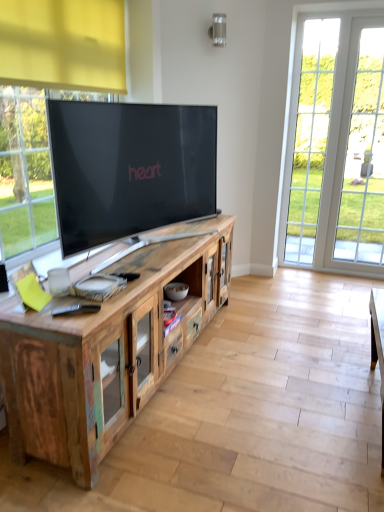
Question: From the image's perspective, is white glass door at right beneath rustic wood cabinet at center?

Choices:
 (A) no
 (B) yes

Answer: (A)

Question: Is the depth of white glass door at right less than that of rustic wood cabinet at center?

Choices:
 (A) no
 (B) yes

Answer: (A)

Question: From the image's perspective, is white glass door at right over rustic wood cabinet at center?

Choices:
 (A) no
 (B) yes

Answer: (B)

Question: Is white glass door at right looking in the opposite direction of rustic wood cabinet at center?

Choices:
 (A) yes
 (B) no

Answer: (B)

Question: Is white glass door at right at the left side of rustic wood cabinet at center?

Choices:
 (A) yes
 (B) no

Answer: (B)

Question: Is rustic wood cabinet at center a part of white glass door at right?

Choices:
 (A) no
 (B) yes

Answer: (A)

Question: Does rustic wood cabinet at center have a greater height compared to white glass door at right?

Choices:
 (A) yes
 (B) no

Answer: (B)

Question: Is rustic wood cabinet at center positioned with its back to white glass door at right?

Choices:
 (A) yes
 (B) no

Answer: (B)

Question: Is rustic wood cabinet at center next to white glass door at right and touching it?

Choices:
 (A) yes
 (B) no

Answer: (B)

Question: Is rustic wood cabinet at center outside of white glass door at right?

Choices:
 (A) no
 (B) yes

Answer: (B)

Question: From a real-world perspective, is rustic wood cabinet at center positioned over white glass door at right based on gravity?

Choices:
 (A) yes
 (B) no

Answer: (B)

Question: Is rustic wood cabinet at center to the left of white glass door at right from the viewer's perspective?

Choices:
 (A) yes
 (B) no

Answer: (A)

Question: From a real-world perspective, relative to white glass door at right, is rustic wood cabinet at center vertically above or below?

Choices:
 (A) below
 (B) above

Answer: (A)